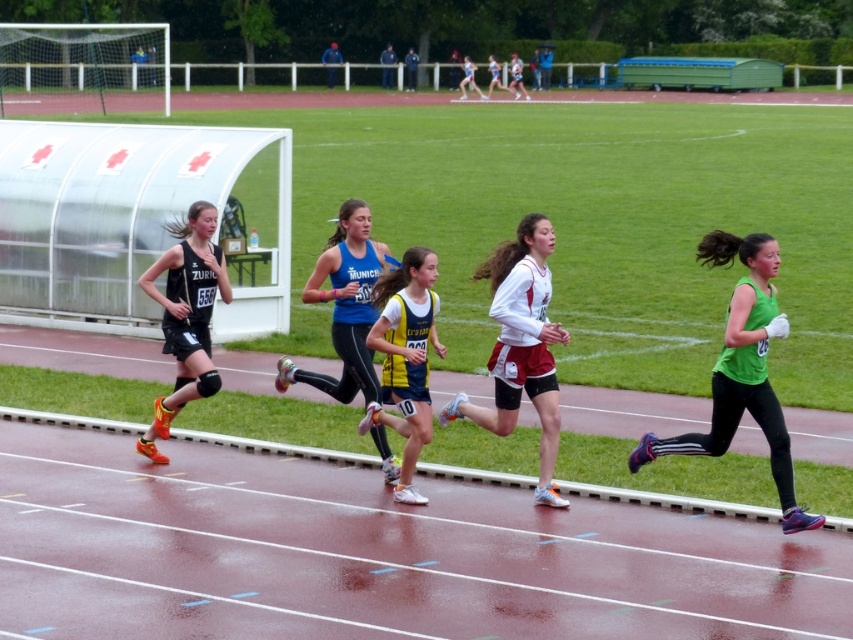
Question: Does matte black shorts at left have a greater width compared to yellow and blue jersey at center?

Choices:
 (A) yes
 (B) no

Answer: (A)

Question: Can you confirm if white matte running uniform at center is positioned to the left of yellow and blue jersey at center?

Choices:
 (A) yes
 (B) no

Answer: (B)

Question: Does white matte running uniform at center have a smaller size compared to matte black shorts at left?

Choices:
 (A) no
 (B) yes

Answer: (A)

Question: Which of these objects is positioned farthest from the matte black shorts at left?

Choices:
 (A) white matte running uniform at center
 (B) yellow and blue jersey at center

Answer: (A)

Question: Which object is positioned closest to the white matte running uniform at center?

Choices:
 (A) blue fabric tank top at center
 (B) green matte tank top at right

Answer: (A)

Question: Which object is farther from the camera taking this photo?

Choices:
 (A) matte black shorts at left
 (B) white matte running uniform at center
 (C) blue fabric tank top at center
 (D) yellow and blue jersey at center

Answer: (A)